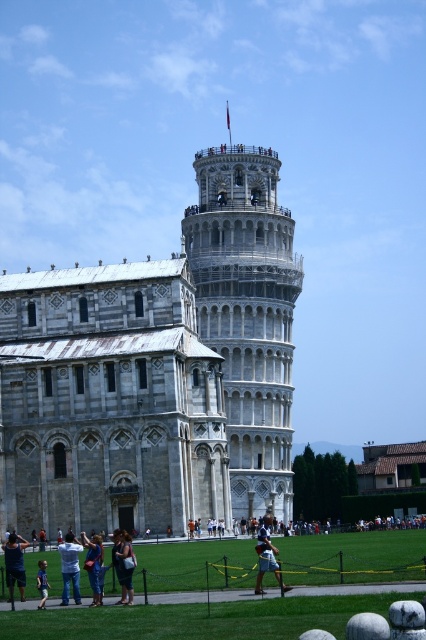
Which is more to the right, denim jacket at lower left or light blue jeans at lower left?

denim jacket at lower left is more to the right.

Does denim jacket at lower left have a lesser height compared to light blue jeans at lower left?

In fact, denim jacket at lower left may be taller than light blue jeans at lower left.

Is point (95, 547) behind point (46, 589)?

That is True.

Where is `denim jacket at lower left`? denim jacket at lower left is located at coordinates (92, 564).

Does light blue denim jeans at lower center have a lesser width compared to light blue jeans at lower left?

Indeed, light blue denim jeans at lower center has a lesser width compared to light blue jeans at lower left.

Who is positioned more to the right, light blue denim jeans at lower center or light blue jeans at lower left?

light blue denim jeans at lower center

Is point (259, 534) farther from camera compared to point (42, 566)?

Yes, point (259, 534) is behind point (42, 566).

Where is `light blue denim jeans at lower center`? light blue denim jeans at lower center is located at coordinates (267, 556).

Who is lower down, blue jeans at lower center or blue denim jeans at lower left?

blue jeans at lower center is below.

Is blue jeans at lower center shorter than blue denim jeans at lower left?

No, blue jeans at lower center is not shorter than blue denim jeans at lower left.

Who is more forward, (65, 554) or (22, 560)?

Answer: Point (65, 554) is in front.

What are the coordinates of `blue jeans at lower center` in the screenshot? It's located at (69, 566).